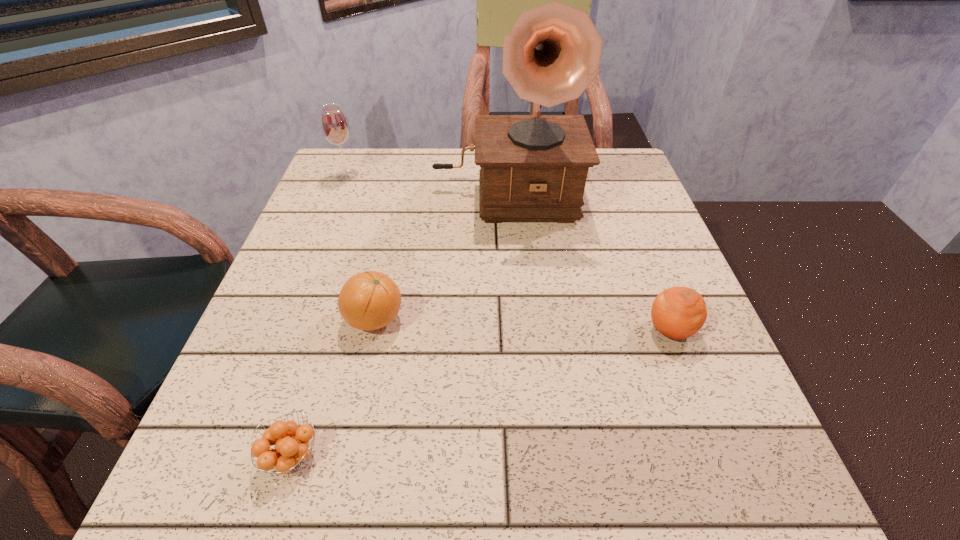
This screenshot has height=540, width=960. I want to click on vacant space located 0.110m on the back of the shortest orange fruit, so click(x=320, y=365).

You are a GUI agent. You are given a task and a screenshot of the screen. Output one action in this format:
    pyautogui.click(x=<x>, y=<y>)
    Task: Click on the record player located in the far edge section of the desktop
    
    Given the screenshot: What is the action you would take?
    pyautogui.click(x=534, y=167)

You are a GUI agent. You are given a task and a screenshot of the screen. Output one action in this format:
    pyautogui.click(x=<x>, y=<y>)
    Task: Click on the wineglass at the far edge
    
    Given the screenshot: What is the action you would take?
    click(x=334, y=124)

This screenshot has height=540, width=960. I want to click on object positioned at the near edge, so click(289, 452).

Locate an element on the screen. wineglass present at the left edge is located at coordinates (334, 124).

Where is `object located in the right edge section of the desktop`? The image size is (960, 540). object located in the right edge section of the desktop is located at coordinates 678,312.

The width and height of the screenshot is (960, 540). Identify the location of object that is at the far left corner. (334, 124).

I want to click on object positioned at the near left corner, so click(x=289, y=452).

Identify the location of free location at the far edge. (391, 187).

Identify the location of vacant space at the left edge. (284, 255).